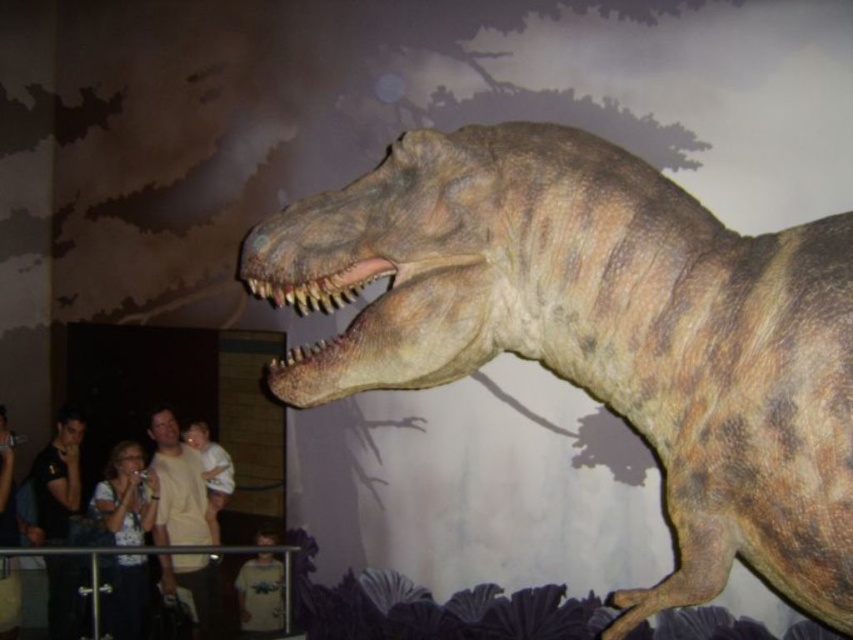
Looking at this image, you are standing in front of the T. rex model and want to take a photo. You notice two points on the model labeled as point (564,248) and point (207,577). Which point will appear larger in your photo?

Point (564,248) will appear larger in the photo because it is closer to the camera than point (207,577).

You are standing in front of the T. rex model and notice two points marked on its body. The first point is at coordinate (180,538) and the second is at (202,452). Which of these two points is closer to you?

Point (180,538) is closer to the camera than point (202,452), so the first point is closer to you.